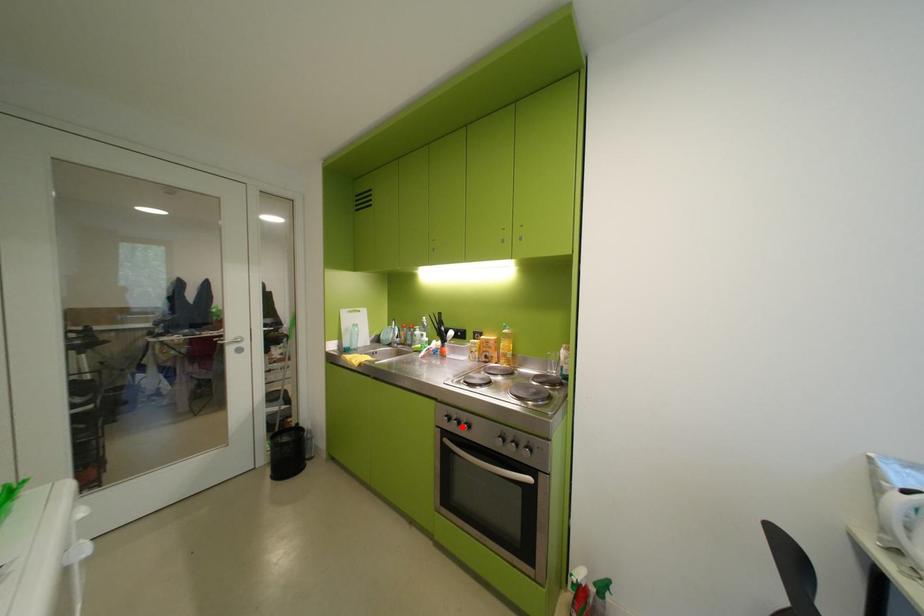
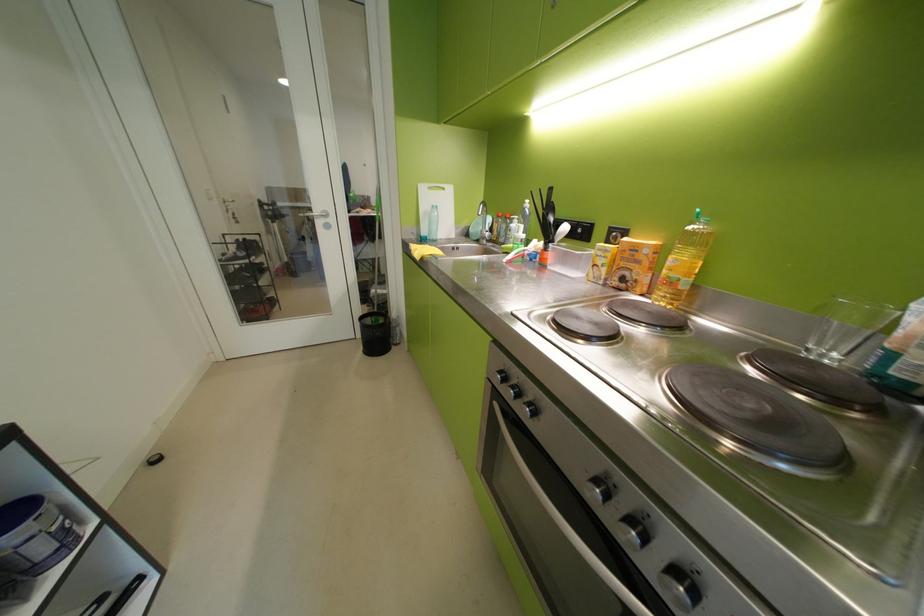
Question: I am providing you with two images of the same scene from different viewpoints. A red point is marked on the first image. Is the red point's position out of view in image 2?

Choices:
 (A) Yes
 (B) No

Answer: (B)